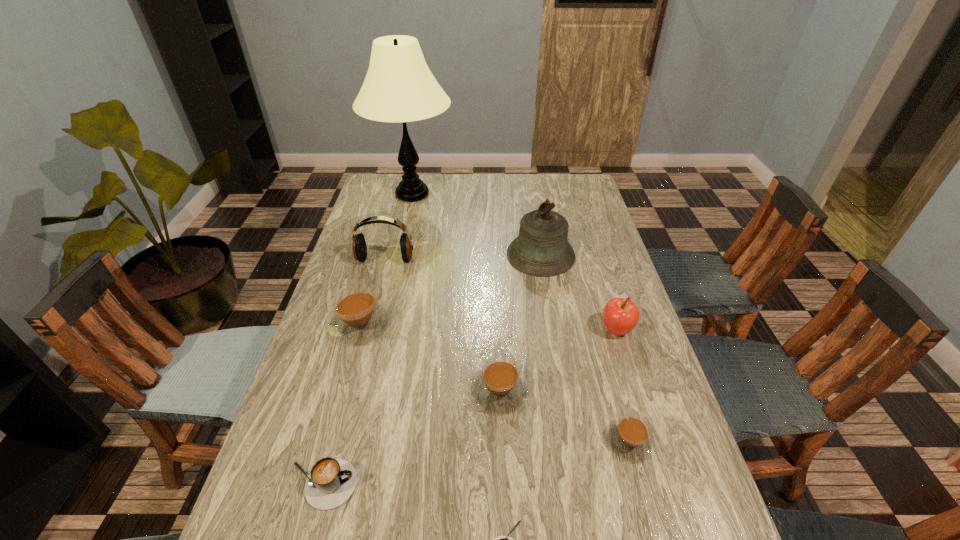
Identify which object is located as the third nearest to the seventh shortest object. Please provide its 2D coordinates. Your answer should be formatted as a tuple, i.e. [(x, y)], where the tuple contains the x and y coordinates of a point satisfying the conditions above.

[(541, 249)]

Image resolution: width=960 pixels, height=540 pixels. What are the coordinates of `cappuccino that is the nearest to the fourth shortest cappuccino` in the screenshot? It's located at coord(629,437).

Identify the location of cappuccino that is the second closest to the fifth shortest object. (331, 482).

Select which brown cappuccino is the second closest to the lamp. Please provide its 2D coordinates. Your answer should be formatted as a tuple, i.e. [(x, y)], where the tuple contains the x and y coordinates of a point satisfying the conditions above.

[(500, 387)]

Locate which brown cappuccino ranks third in proximity to the sixth shortest object. Please provide its 2D coordinates. Your answer should be formatted as a tuple, i.e. [(x, y)], where the tuple contains the x and y coordinates of a point satisfying the conditions above.

[(358, 318)]

Locate an element on the screen. This screenshot has width=960, height=540. free location that satisfies the following two spatial constraints: 1. on the back side of the fourth shortest cappuccino; 2. on the left side of the apple is located at coordinates (497, 330).

Identify the location of vacant area in the image that satisfies the following two spatial constraints: 1. on the ear cups of the headset; 2. on the right side of the rightmost cappuccino. This screenshot has height=540, width=960. (338, 441).